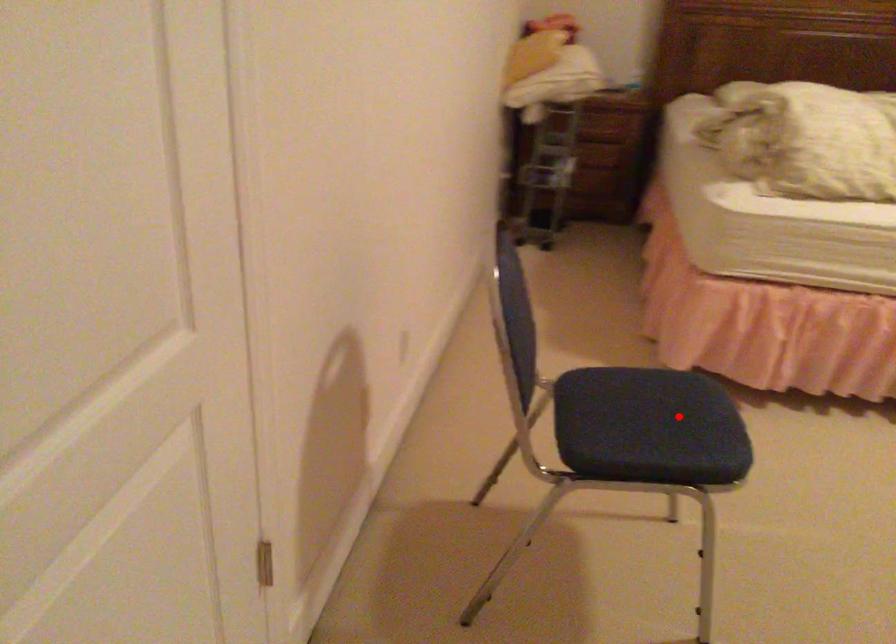
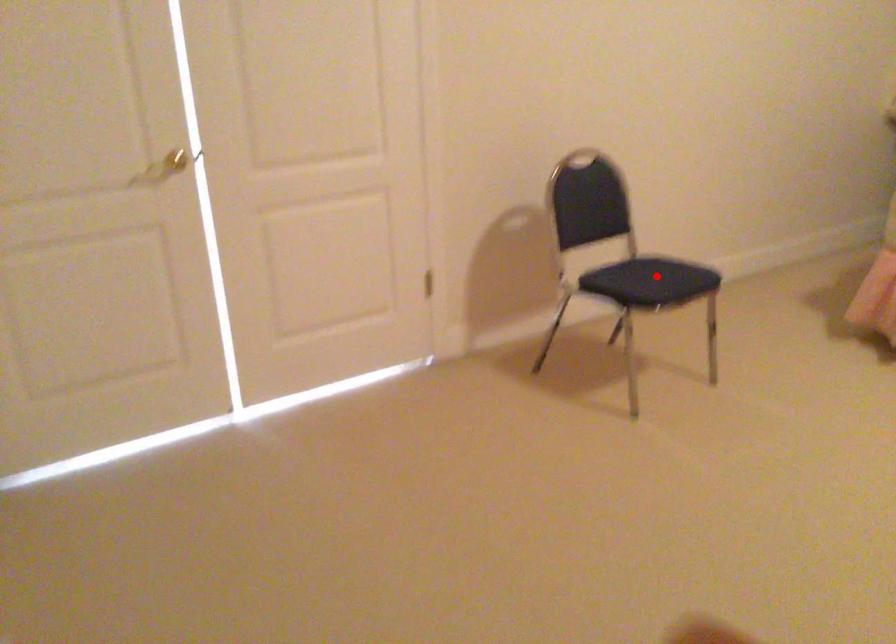
I am providing you with two images of the same scene from different viewpoints. A red point is marked on the first image and another point is marked on the second image. Does the point marked in image1 correspond to the same location as the one in image2?

Yes